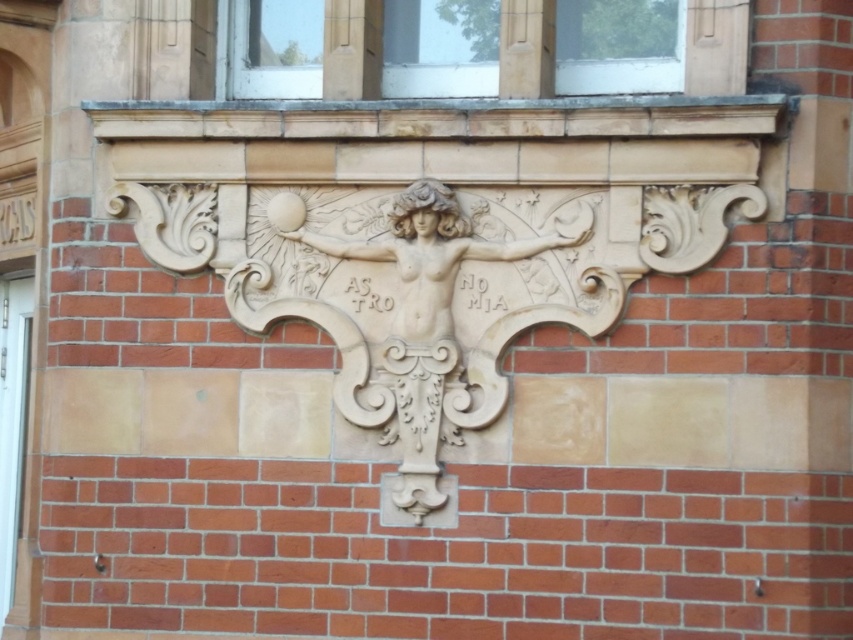
You are an architect examining the building facade. You notice the matte glass window at upper center and the white stone writing at center. According to the design, which object is located to the right of the other?

The matte glass window at upper center is positioned on the right side of white stone writing at center.

Based on the scene described, which object is positioned to the left when observing the white stone relief at center and the white stone writing at center?

The white stone relief at center is positioned to the left of the white stone writing at center.